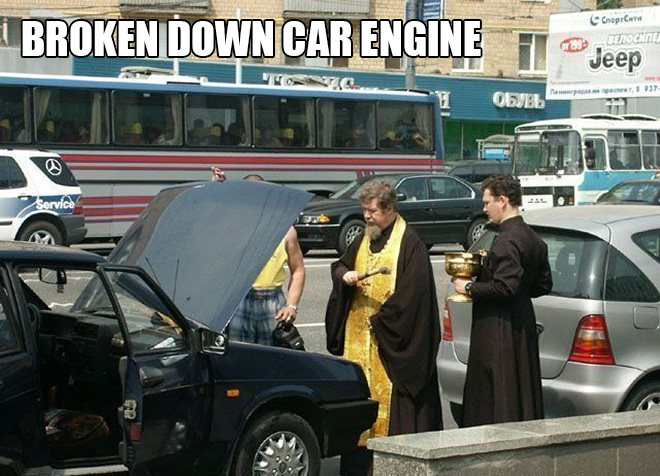
Image resolution: width=660 pixels, height=476 pixels. I want to click on concrete wall, so click(589, 460).